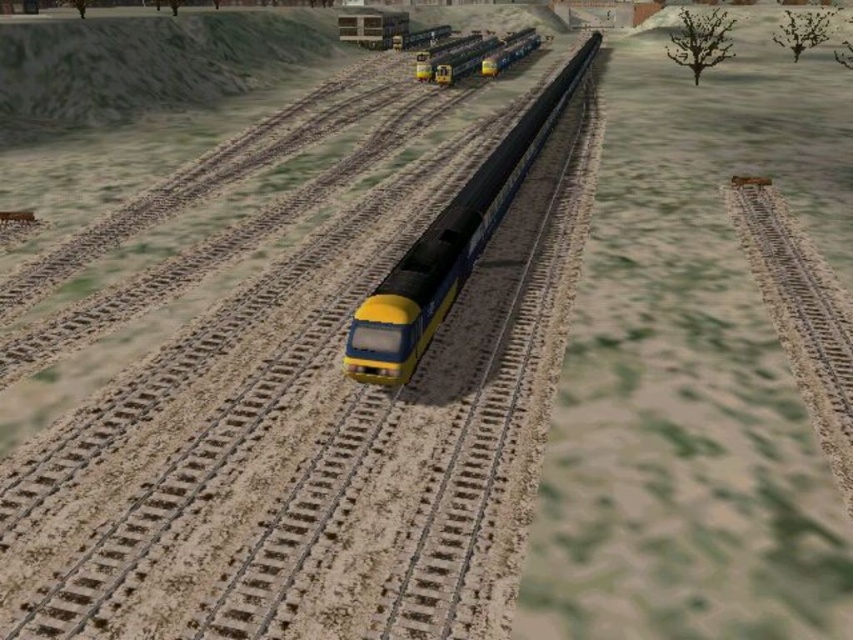
Question: Does yellow matte train track at center come behind yellow matte train at center?

Choices:
 (A) no
 (B) yes

Answer: (A)

Question: Which of the following is the farthest from the observer?

Choices:
 (A) (32, 636)
 (B) (384, 378)
 (C) (495, 44)

Answer: (C)

Question: Is yellow matte train track at center to the right of yellow matte train at center from the viewer's perspective?

Choices:
 (A) yes
 (B) no

Answer: (B)

Question: Estimate the real-world distances between objects in this image. Which object is farther from the yellow matte train at center?

Choices:
 (A) yellow matte train track at center
 (B) yellow matte train at upper center

Answer: (B)

Question: From the image, what is the correct spatial relationship of yellow matte train at center in relation to yellow matte train at upper center?

Choices:
 (A) above
 (B) below

Answer: (B)

Question: Among these objects, which one is farthest from the camera?

Choices:
 (A) yellow matte train at upper center
 (B) yellow matte train at center
 (C) yellow matte train track at center

Answer: (A)